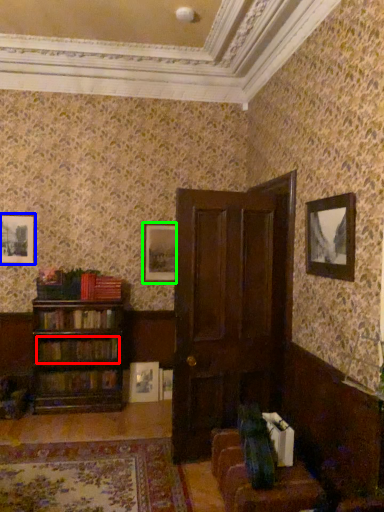
Question: Estimate the real-world distances between objects in this image. Which object is closer to book (highlighted by a red box), picture frame (highlighted by a blue box) or picture frame (highlighted by a green box)?

Choices:
 (A) picture frame
 (B) picture frame

Answer: (B)